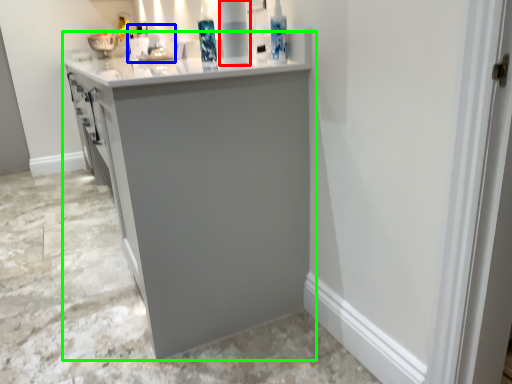
Question: Which is nearer to the appliance (highlighted by a red box)? sink (highlighted by a blue box) or cabinetry (highlighted by a green box).

Choices:
 (A) sink
 (B) cabinetry

Answer: (B)